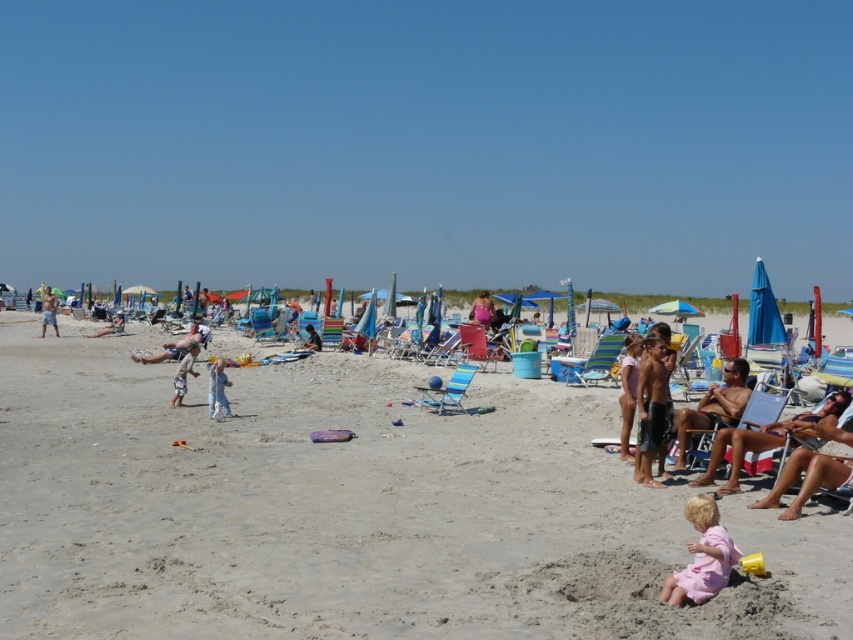
You are standing on the beach and see the wooden beach chair at center and the white cotton shirt at center. Which object is positioned to the right?

The wooden beach chair at center is positioned to the right of the white cotton shirt at center.

You are standing at the origin point of the coordinate system where the beach scene is depicted. There is a wooden beach chair at center located at point [761,410]. If you want to walk directly towards this wooden beach chair at center, in which direction should you move?

Since the wooden beach chair at center is located at point [761,410], you should move towards the center of the beach scene to reach it.